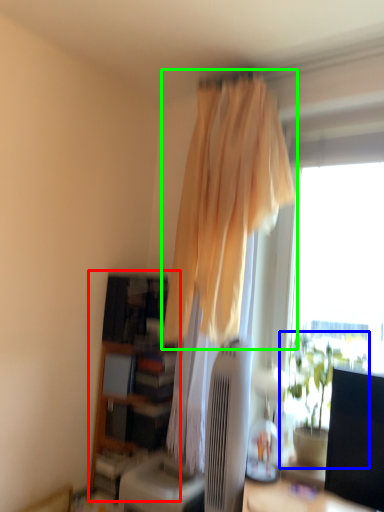
Question: Which object is positioned farthest from bookshelf (highlighted by a red box)? Select from houseplant (highlighted by a blue box) and curtain (highlighted by a green box).

Choices:
 (A) houseplant
 (B) curtain

Answer: (A)